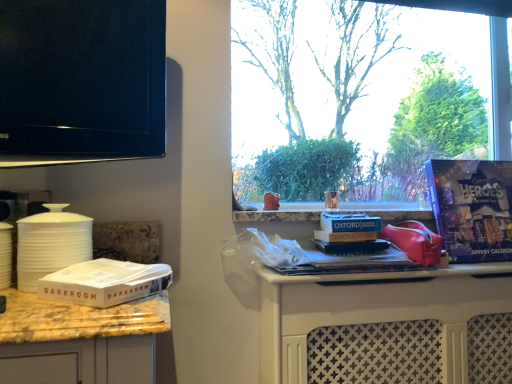
The image size is (512, 384). What do you see at coordinates (51, 244) in the screenshot? I see `white matte canister at left` at bounding box center [51, 244].

What do you see at coordinates (81, 81) in the screenshot?
I see `black glossy tv at upper left` at bounding box center [81, 81].

The width and height of the screenshot is (512, 384). What are the coordinates of `white plastic bag at center` in the screenshot? It's located at (282, 213).

Could you tell me if white matte canister at left is turned towards purple cardboard advent calendar at right?

No, white matte canister at left is not oriented towards purple cardboard advent calendar at right.

Between white matte canister at left and purple cardboard advent calendar at right, which one has larger width?

With larger width is purple cardboard advent calendar at right.

From the picture: Who is bigger, white matte canister at left or purple cardboard advent calendar at right?

purple cardboard advent calendar at right is bigger.

Can you see white matte canister at left touching purple cardboard advent calendar at right?

white matte canister at left and purple cardboard advent calendar at right are not in contact.

Looking at this image, is purple cardboard advent calendar at right facing towards white cardboard box at lower left?

No, purple cardboard advent calendar at right is not facing towards white cardboard box at lower left.

Are purple cardboard advent calendar at right and white cardboard box at lower left far apart?

Yes.

Is point (485, 242) positioned behind point (105, 284)?

Yes, it is behind point (105, 284).

Is white plastic bag at center not near black glossy tv at upper left?

No, white plastic bag at center is not far from black glossy tv at upper left.

Which is more to the left, white plastic bag at center or black glossy tv at upper left?

black glossy tv at upper left is more to the left.

Looking at this image, from the image's perspective, is white plastic bag at center located above black glossy tv at upper left?

No.

Which object is further away from the camera taking this photo, white plastic bag at center or black glossy tv at upper left?

white plastic bag at center is further from the camera.

In the scene shown: Can white cardboard box at lower left be found inside white plastic bag at center?

No, white cardboard box at lower left is not surrounded by white plastic bag at center.

Considering the positions of points (355, 210) and (110, 295), is point (355, 210) farther from camera compared to point (110, 295)?

Yes, it is.

Is white plastic bag at center facing towards white cardboard box at lower left?

No, white plastic bag at center is not facing towards white cardboard box at lower left.

Which is less distant, [100,46] or [484,208]?

Point [100,46].

Between black glossy tv at upper left and purple cardboard advent calendar at right, which one has less height?

Standing shorter between the two is purple cardboard advent calendar at right.

In the image, is black glossy tv at upper left positioned in front of or behind purple cardboard advent calendar at right?

black glossy tv at upper left is in front of purple cardboard advent calendar at right.

Which object is thinner, white cardboard box at lower left or white plastic bag at center?

white cardboard box at lower left is thinner.

Is point (157, 274) in front of point (307, 215)?

Yes, point (157, 274) is in front of point (307, 215).

Which object is further away from the camera, white cardboard box at lower left or white plastic bag at center?

white plastic bag at center is more distant.

Is white cardboard box at lower left looking in the opposite direction of white plastic bag at center?

Yes, white cardboard box at lower left's orientation is away from white plastic bag at center.

Is purple cardboard advent calendar at right at the back of white plastic bag at center?

No, white plastic bag at center is not facing the opposite direction of purple cardboard advent calendar at right.

Would you consider white plastic bag at center to be distant from purple cardboard advent calendar at right?

white plastic bag at center is near purple cardboard advent calendar at right, not far away.

This screenshot has height=384, width=512. In order to click on magazine lying above the white plastic bag at center (from the image's perspective) in this screenshot , I will do `click(472, 208)`.

At what (x,y) coordinates should I click in order to perform the action: click on magazine located on the right of white matte canister at left. Please return your answer as a coordinate pair (x, y). Looking at the image, I should click on (472, 208).

At what (x,y) coordinates should I click in order to perform the action: click on box in front of the purple cardboard advent calendar at right. Please return your answer as a coordinate pair (x, y). The image size is (512, 384). Looking at the image, I should click on (104, 282).

When comparing their distances from white matte canister at left, does purple cardboard advent calendar at right or white cardboard box at lower left seem closer?

Based on the image, white cardboard box at lower left appears to be nearer to white matte canister at left.

Looking at the image, which one is located further to white plastic bag at center, white matte canister at left or purple cardboard advent calendar at right?

white matte canister at left is further to white plastic bag at center.

When comparing their distances from white plastic bag at center, does purple cardboard advent calendar at right or white matte canister at left seem closer?

purple cardboard advent calendar at right is positioned closer to the anchor white plastic bag at center.

From the picture: When comparing their distances from white matte canister at left, does purple cardboard advent calendar at right or black glossy tv at upper left seem closer?

Among the two, black glossy tv at upper left is located nearer to white matte canister at left.

Considering their positions, is white plastic bag at center positioned further to purple cardboard advent calendar at right than black glossy tv at upper left?

black glossy tv at upper left is further to purple cardboard advent calendar at right.

From the image, which object appears to be farther from black glossy tv at upper left, white matte canister at left or white cardboard box at lower left?

Based on the image, white cardboard box at lower left appears to be further to black glossy tv at upper left.

From the image, which object appears to be nearer to black glossy tv at upper left, purple cardboard advent calendar at right or white plastic bag at center?

white plastic bag at center.

Based on their spatial positions, is purple cardboard advent calendar at right or black glossy tv at upper left closer to white plastic bag at center?

purple cardboard advent calendar at right is closer to white plastic bag at center.

At what (x,y) coordinates should I click in order to perform the action: click on window sill between black glossy tv at upper left and purple cardboard advent calendar at right in the horizontal direction. Please return your answer as a coordinate pair (x, y). Looking at the image, I should click on (282, 213).

You are a GUI agent. You are given a task and a screenshot of the screen. Output one action in this format:
    pyautogui.click(x=<x>, y=<y>)
    Task: Click on the box situated between black glossy tv at upper left and white plastic bag at center from left to right
    The image size is (512, 384).
    Given the screenshot: What is the action you would take?
    pyautogui.click(x=104, y=282)

Identify the location of kitchen appliance between black glossy tv at upper left and white cardboard box at lower left in the vertical direction. The width and height of the screenshot is (512, 384). (51, 244).

Where is `box between black glossy tv at upper left and purple cardboard advent calendar at right in the horizontal direction`? Image resolution: width=512 pixels, height=384 pixels. box between black glossy tv at upper left and purple cardboard advent calendar at right in the horizontal direction is located at coordinates (104, 282).